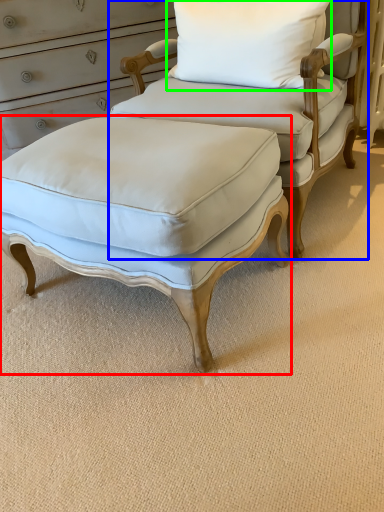
Question: Estimate the real-world distances between objects in this image. Which object is farther from stool (highlighted by a red box), chair (highlighted by a blue box) or pillow (highlighted by a green box)?

Choices:
 (A) chair
 (B) pillow

Answer: (B)